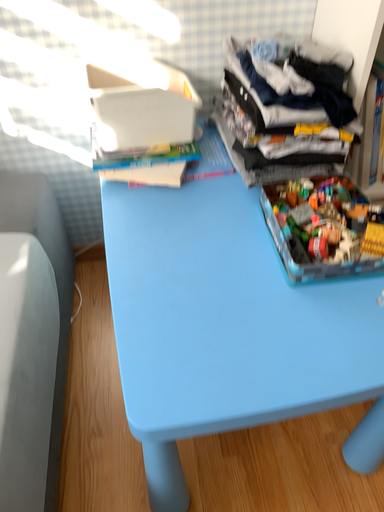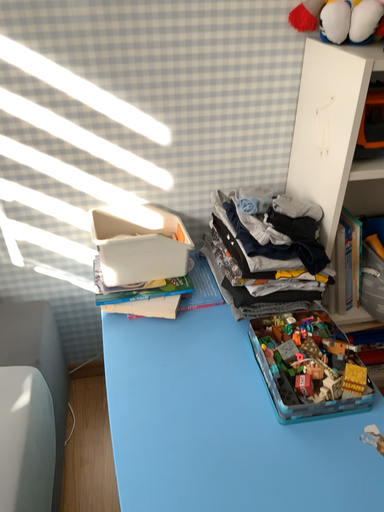
Question: Which way did the camera rotate in the video?

Choices:
 (A) rotated downward
 (B) rotated upward

Answer: (B)